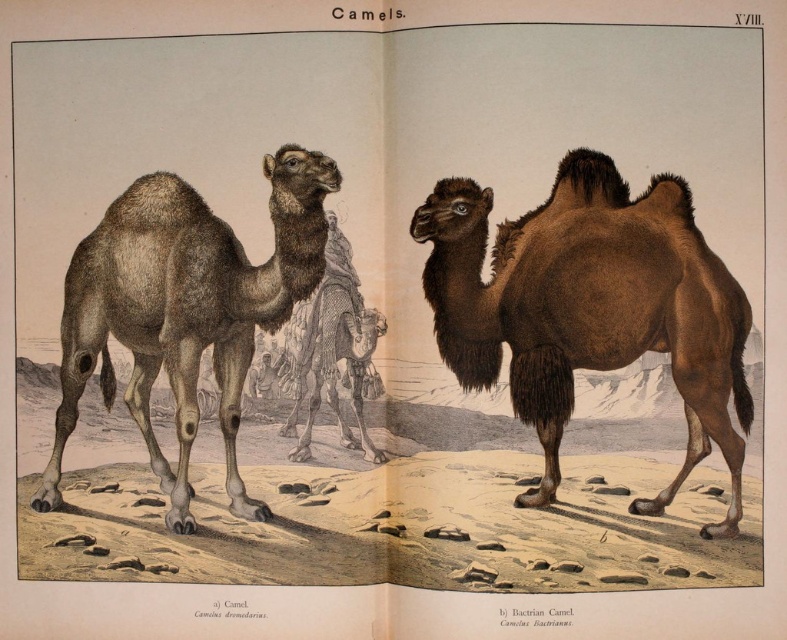
Who is more forward, (235,376) or (350,385)?

Point (350,385) is more forward.

Does brown fuzzy camel at left have a larger size compared to brown fuzzy camel at center?

Yes, brown fuzzy camel at left is bigger than brown fuzzy camel at center.

Describe the element at coordinates (185, 308) in the screenshot. I see `brown fuzzy camel at left` at that location.

What are the coordinates of `brown fuzzy camel at left` in the screenshot? It's located at (185, 308).

Who is positioned more to the left, brown fuzzy bactrian camel at center or brown fuzzy camel at left?

From the viewer's perspective, brown fuzzy camel at left appears more on the left side.

Does point (571, 268) come in front of point (87, 323)?

Yes, it is.

The width and height of the screenshot is (787, 640). In order to click on brown fuzzy bactrian camel at center in this screenshot , I will do `click(589, 307)`.

Is brown fuzzy bactrian camel at center to the right of brown fuzzy camel at center from the viewer's perspective?

Indeed, brown fuzzy bactrian camel at center is positioned on the right side of brown fuzzy camel at center.

This screenshot has width=787, height=640. What do you see at coordinates (589, 307) in the screenshot? I see `brown fuzzy bactrian camel at center` at bounding box center [589, 307].

Is point (721, 401) positioned after point (350, 326)?

No, (721, 401) is closer to viewer.

Image resolution: width=787 pixels, height=640 pixels. What are the coordinates of `brown fuzzy bactrian camel at center` in the screenshot? It's located at (589, 307).